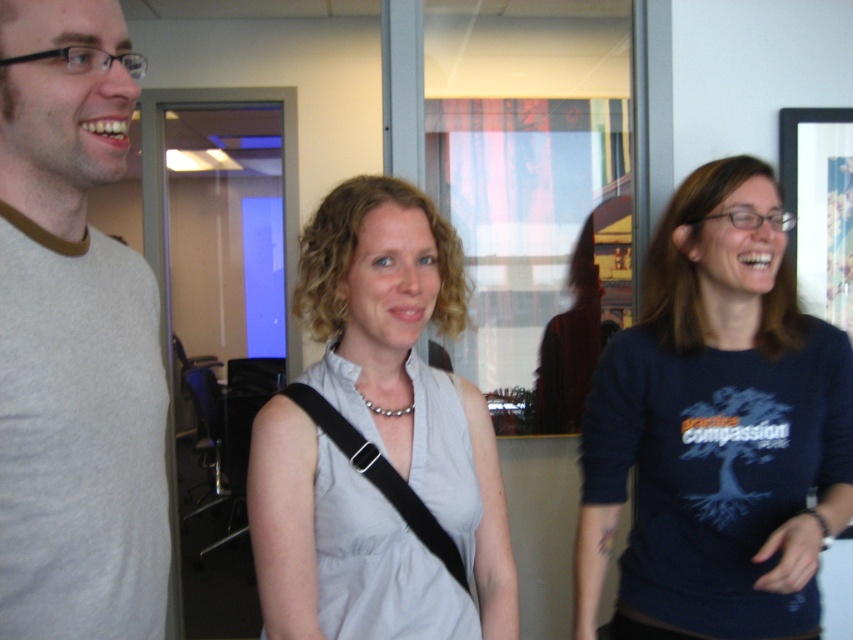
Question: Can you confirm if dark blue cotton shirt at center is positioned above light gray fabric dress at center?

Choices:
 (A) no
 (B) yes

Answer: (A)

Question: Based on their relative distances, which object is farther from the light gray fabric dress at center?

Choices:
 (A) gray cotton t-shirt at left
 (B) dark blue cotton shirt at center

Answer: (B)

Question: Which of the following is the closest to the observer?

Choices:
 (A) (248, 500)
 (B) (4, 385)

Answer: (B)

Question: Estimate the real-world distances between objects in this image. Which object is farther from the light gray fabric dress at center?

Choices:
 (A) dark blue cotton shirt at center
 (B) gray cotton t-shirt at left

Answer: (A)

Question: Is dark blue cotton shirt at center to the right of light gray fabric dress at center from the viewer's perspective?

Choices:
 (A) yes
 (B) no

Answer: (A)

Question: Where is dark blue cotton shirt at center located in relation to gray cotton t-shirt at left in the image?

Choices:
 (A) right
 (B) left

Answer: (A)